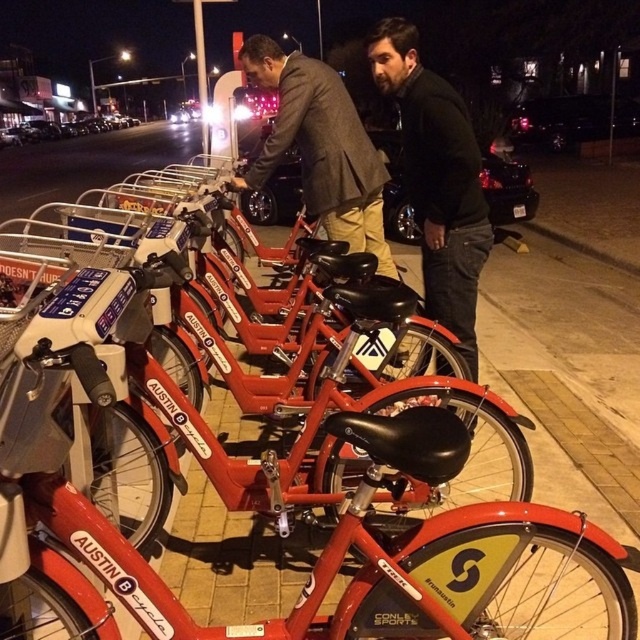
You are a delivery person trying to squeeze through a narrow alley between two buildings. You see a matte black jacket at center and a dark brown leather jacket at center. Which jacket is more likely to block your path due to its width?

The matte black jacket at center might be wider than the dark brown leather jacket at center, so it is more likely to block your path due to its width.

You are a photographer who needs to take a clear photo of the matte black jacket at center without the camera in the shot. Can you step back enough to capture the jacket while keeping the camera out of the frame?

The matte black jacket at center and camera are 9.83 feet apart from each other. Since the photographer needs to step back to ensure the camera isn not in the frame, the distance of 9.83 feet allows enough space to position the camera away while capturing the jacket.